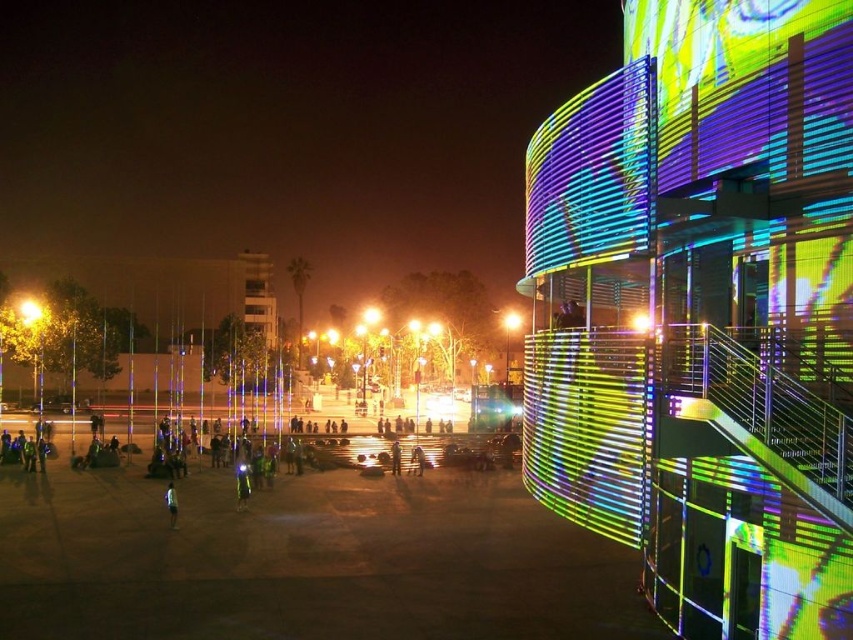
Question: Which point is farther to the camera?

Choices:
 (A) (177, 509)
 (B) (25, 310)
 (C) (247, 481)

Answer: (B)

Question: Which object appears farthest from the camera in this image?

Choices:
 (A) light blue fabric pants at lower center
 (B) light brown fabric pants at lower left
 (C) yellow metallic streetlight at center

Answer: (C)

Question: Does light blue fabric pants at lower center have a lesser width compared to bright yellow light at center?

Choices:
 (A) yes
 (B) no

Answer: (B)

Question: Can you confirm if bright yellow light at center is positioned below light brown fabric pants at lower left?

Choices:
 (A) yes
 (B) no

Answer: (B)

Question: Which object appears farthest from the camera in this image?

Choices:
 (A) yellow metallic streetlight at center
 (B) light brown fabric pants at lower left
 (C) light blue fabric pants at lower center

Answer: (A)

Question: Observing the image, what is the correct spatial positioning of light brown fabric pants at lower left in reference to yellow metallic streetlight at center?

Choices:
 (A) below
 (B) above

Answer: (A)